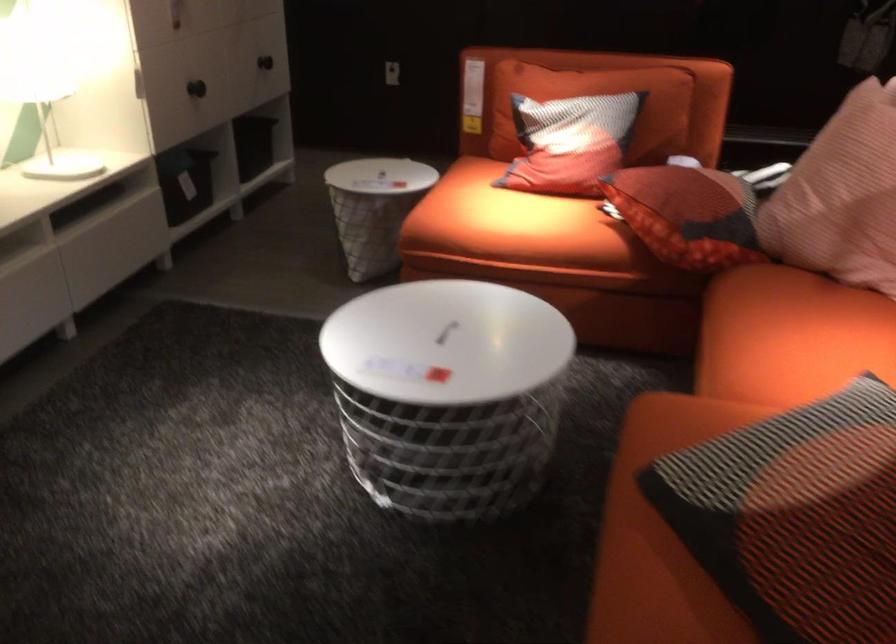
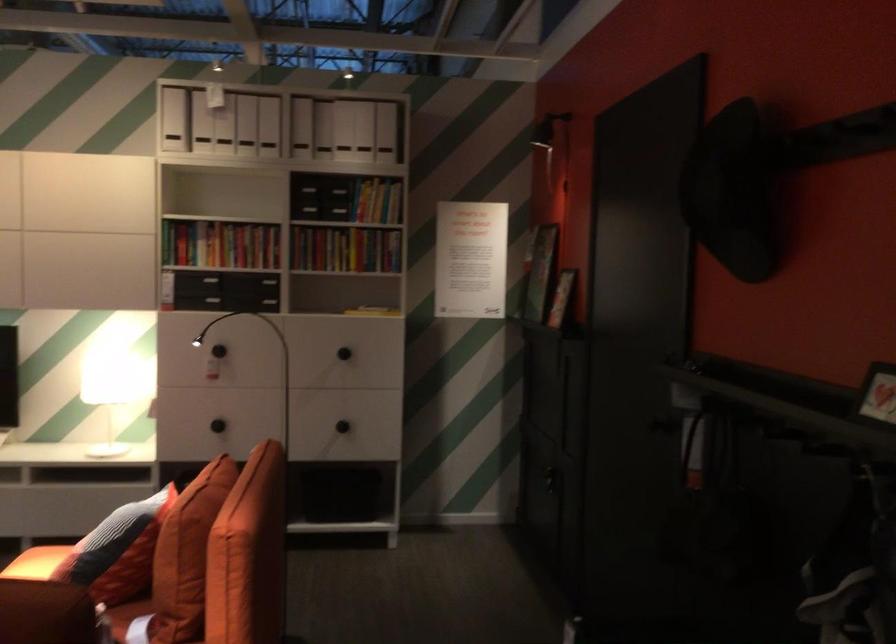
Find the pixel in the second image that matches point 640,118 in the first image.

(117, 551)